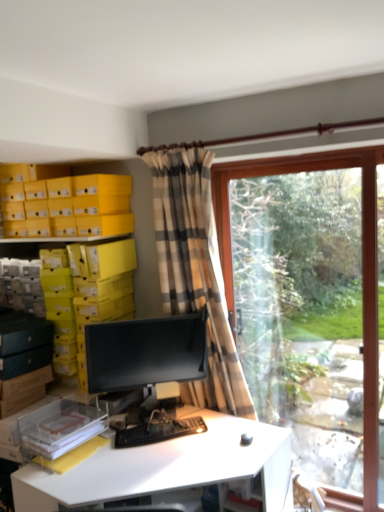
Identify the location of free location above white glossy desk at center (from a real-world perspective). (158, 459).